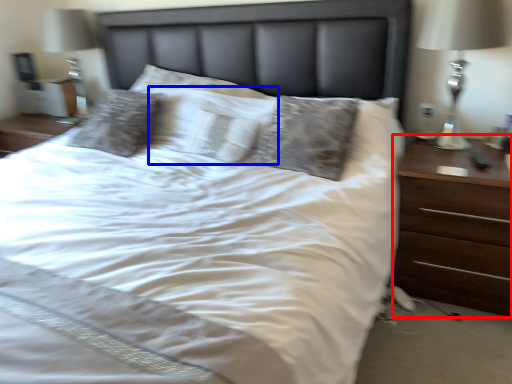
Question: Which object appears farthest to the camera in this image, nightstand (highlighted by a red box) or pillow (highlighted by a blue box)?

Choices:
 (A) nightstand
 (B) pillow

Answer: (B)